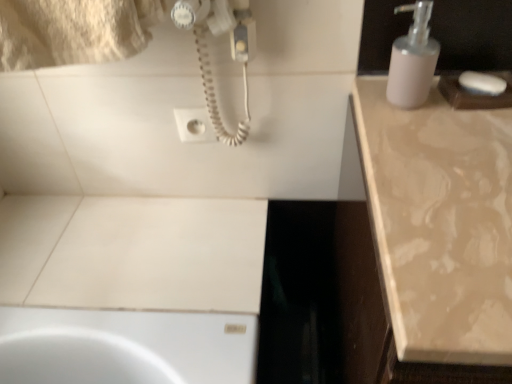
Question: Is white matte soap dispenser at upper right positioned in front of white matte soap at upper right?

Choices:
 (A) yes
 (B) no

Answer: (A)

Question: Is white matte soap dispenser at upper right wider than white matte soap at upper right?

Choices:
 (A) no
 (B) yes

Answer: (B)

Question: Is white matte soap dispenser at upper right at the right side of white matte soap at upper right?

Choices:
 (A) no
 (B) yes

Answer: (A)

Question: Is white matte soap dispenser at upper right placed right next to white matte soap at upper right?

Choices:
 (A) yes
 (B) no

Answer: (B)

Question: From the image's perspective, is white matte soap dispenser at upper right on top of white matte soap at upper right?

Choices:
 (A) no
 (B) yes

Answer: (B)

Question: Looking at their shapes, would you say white matte soap at upper right is wider or thinner than beige marble countertop at right?

Choices:
 (A) thin
 (B) wide

Answer: (A)

Question: In terms of height, does white matte soap at upper right look taller or shorter compared to beige marble countertop at right?

Choices:
 (A) tall
 (B) short

Answer: (B)

Question: From a real-world perspective, is white matte soap at upper right physically located above or below beige marble countertop at right?

Choices:
 (A) above
 (B) below

Answer: (A)

Question: Considering their positions, is white matte soap at upper right located in front of or behind beige marble countertop at right?

Choices:
 (A) behind
 (B) front

Answer: (A)

Question: Considering the relative positions of white plastic socket at upper center and white matte soap at upper right in the image provided, is white plastic socket at upper center to the left or to the right of white matte soap at upper right?

Choices:
 (A) right
 (B) left

Answer: (B)

Question: From a real-world perspective, is white plastic socket at upper center above or below white matte soap at upper right?

Choices:
 (A) below
 (B) above

Answer: (A)

Question: Based on their sizes in the image, would you say white plastic socket at upper center is bigger or smaller than white matte soap at upper right?

Choices:
 (A) small
 (B) big

Answer: (A)

Question: Relative to white matte soap at upper right, is white plastic socket at upper center in front or behind?

Choices:
 (A) front
 (B) behind

Answer: (B)

Question: Considering the positions of white matte soap dispenser at upper right and white matte soap at upper right in the image, is white matte soap dispenser at upper right wider or thinner than white matte soap at upper right?

Choices:
 (A) thin
 (B) wide

Answer: (B)

Question: From a real-world perspective, relative to white matte soap at upper right, is white matte soap dispenser at upper right vertically above or below?

Choices:
 (A) above
 (B) below

Answer: (A)